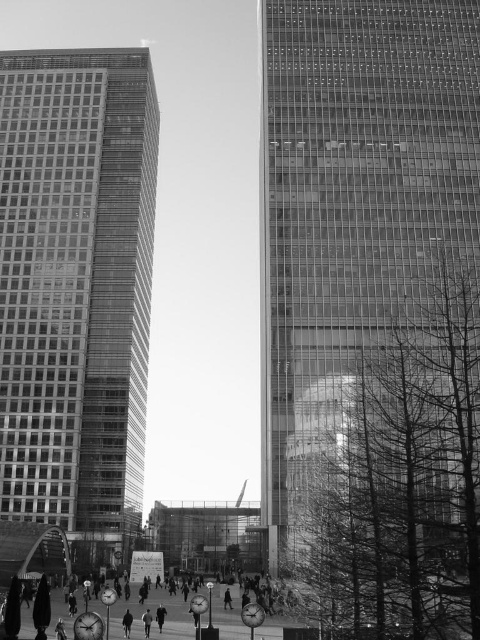
You are standing at the base of the taller skyscraper on the right in the image. You notice two points marked in the scene. One is at coordinate point (460, 176) and the other at point (146, 634). Which point is closer to your current position?

Point (146, 634) is closer to your current position because it is less far from the camera than point (460, 176).

You are a city planner who needs to install a new streetlight between the glassy reflective skyscraper at right and the glassy reflective skyscraper at left. The streetlight requires a minimum of 25 meters of space to be safely installed. Based on the scene, can the streetlight be placed between them?

The glassy reflective skyscraper at right and glassy reflective skyscraper at left are 26.96 meters apart, which is more than the required 25 meters. Therefore, the streetlight can be safely installed between them.

You are standing at the center of the scene and want to locate the glassy reflective skyscraper at right. According to the coordinates provided, in which general direction should you look?

The glassy reflective skyscraper at right is located at coordinates point (354, 205), which corresponds to the upper right direction from your current position at the center.